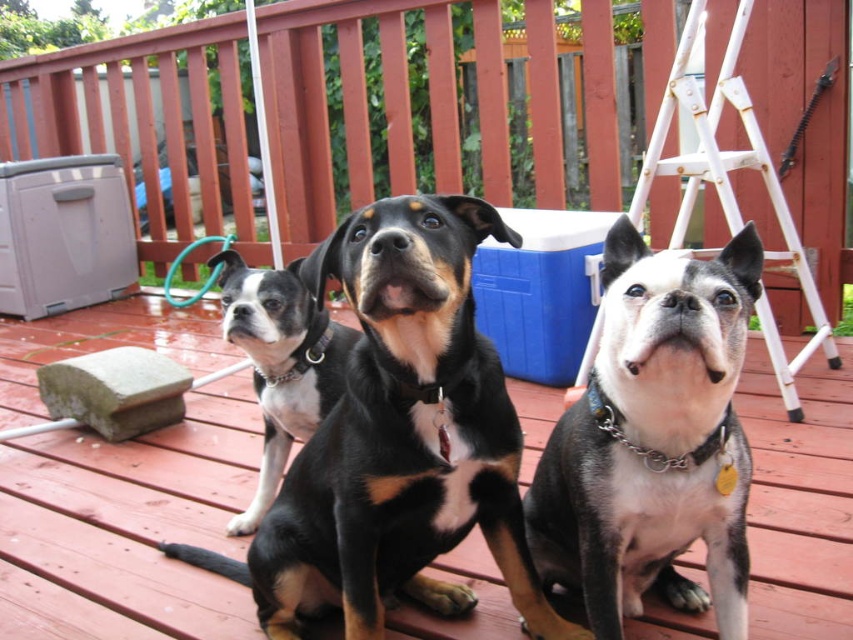
Question: Does black and white fur at center appear on the left side of blue plastic cooler at center?

Choices:
 (A) yes
 (B) no

Answer: (A)

Question: Among these points, which one is farthest from the camera?

Choices:
 (A) (556, 486)
 (B) (0, 168)
 (C) (543, 221)
 (D) (274, 424)

Answer: (B)

Question: Can you confirm if wooden deck at center is positioned to the left of black and white fur at center?

Choices:
 (A) yes
 (B) no

Answer: (A)

Question: Where is wooden deck at center located in relation to blue plastic cooler at center in the image?

Choices:
 (A) below
 (B) above

Answer: (A)

Question: Which object is positioned farthest from the wooden deck at center?

Choices:
 (A) black and white fur at center
 (B) white-furred dog at center
 (C) blue plastic cooler at center
 (D) black shiny dog at center

Answer: (C)

Question: Among these points, which one is farthest from the camera?

Choices:
 (A) (100, 186)
 (B) (558, 376)

Answer: (A)